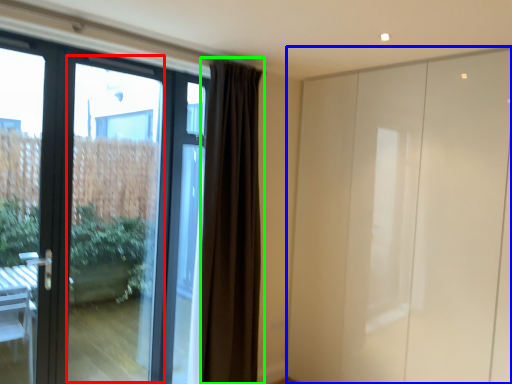
Question: Which object is the closest to the glass door (highlighted by a red box)? Choose among these: screen door (highlighted by a blue box) or curtain (highlighted by a green box).

Choices:
 (A) screen door
 (B) curtain

Answer: (B)